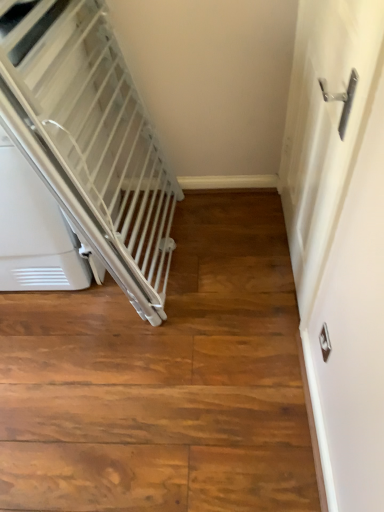
The height and width of the screenshot is (512, 384). What do you see at coordinates (90, 139) in the screenshot?
I see `white plastic escalator at left` at bounding box center [90, 139].

The image size is (384, 512). I want to click on white plastic escalator at left, so click(x=90, y=139).

What is the approximate height of white plastic escalator at left?

white plastic escalator at left is 35.92 inches tall.

The width and height of the screenshot is (384, 512). What do you see at coordinates (340, 239) in the screenshot? I see `white metallic door handle at right` at bounding box center [340, 239].

This screenshot has height=512, width=384. In order to click on white metallic door handle at right in this screenshot , I will do `click(340, 239)`.

Identify the location of white plastic escalator at left. (90, 139).

Between white plastic escalator at left and white metallic door handle at right, which one appears on the left side from the viewer's perspective?

Positioned to the left is white plastic escalator at left.

Does white plastic escalator at left come in front of white metallic door handle at right?

No, white plastic escalator at left is further to the viewer.

Considering the points (155, 212) and (327, 294), which point is behind, point (155, 212) or point (327, 294)?

The point (155, 212) is farther.

From the image's perspective, which one is positioned higher, white plastic escalator at left or white metallic door handle at right?

white plastic escalator at left is shown above in the image.

From a real-world perspective, relative to white metallic door handle at right, is white plastic escalator at left vertically above or below?

white plastic escalator at left is situated lower than white metallic door handle at right in the real world.

Considering the sizes of objects white plastic escalator at left and white metallic door handle at right in the image provided, who is wider, white plastic escalator at left or white metallic door handle at right?

white plastic escalator at left.

Does white plastic escalator at left have a greater height compared to white metallic door handle at right?

No, white plastic escalator at left is not taller than white metallic door handle at right.

Which of these two, white plastic escalator at left or white metallic door handle at right, is bigger?

white plastic escalator at left is bigger.

Is white metallic door handle at right completely or partially inside white plastic escalator at left?

Actually, white metallic door handle at right is outside white plastic escalator at left.

Is white plastic escalator at left next to white metallic door handle at right and touching it?

No, white plastic escalator at left is not touching white metallic door handle at right.

Is white plastic escalator at left facing away from white metallic door handle at right?

white plastic escalator at left is not turned away from white metallic door handle at right.

How many degrees apart are the facing directions of white plastic escalator at left and white metallic door handle at right?

The angular difference between white plastic escalator at left and white metallic door handle at right is 91.6 degrees.

In order to click on door located on the right of white plastic escalator at left in this screenshot , I will do `click(340, 239)`.

Which is more to the right, white metallic door handle at right or white plastic escalator at left?

Positioned to the right is white metallic door handle at right.

Between white metallic door handle at right and white plastic escalator at left, which one is positioned behind?

white plastic escalator at left is more distant.

Considering the points (359, 352) and (88, 221), which point is in front, point (359, 352) or point (88, 221)?

Point (359, 352)

From the image's perspective, which one is positioned lower, white metallic door handle at right or white plastic escalator at left?

white metallic door handle at right.

From a real-world perspective, is white metallic door handle at right beneath white plastic escalator at left?

No, from a real-world perspective, white metallic door handle at right is not below white plastic escalator at left.

Which of these two, white metallic door handle at right or white plastic escalator at left, is wider?

With larger width is white plastic escalator at left.

Does white metallic door handle at right have a greater height compared to white plastic escalator at left?

Yes, white metallic door handle at right is taller than white plastic escalator at left.

Considering the sizes of objects white metallic door handle at right and white plastic escalator at left in the image provided, who is smaller, white metallic door handle at right or white plastic escalator at left?

white metallic door handle at right is smaller.

Is white metallic door handle at right inside the boundaries of white plastic escalator at left, or outside?

white metallic door handle at right lies outside white plastic escalator at left.

Is white metallic door handle at right directly adjacent to white plastic escalator at left?

No, white metallic door handle at right is not touching white plastic escalator at left.

Is white metallic door handle at right looking in the opposite direction of white plastic escalator at left?

No.

How distant is white metallic door handle at right from white plastic escalator at left?

white metallic door handle at right is 26.45 inches from white plastic escalator at left.

Locate an element on the screen. This screenshot has width=384, height=512. door lying in front of the white plastic escalator at left is located at coordinates (340, 239).

Where is `escalator directly beneath the white metallic door handle at right (from a real-world perspective)`? The image size is (384, 512). escalator directly beneath the white metallic door handle at right (from a real-world perspective) is located at coordinates (90, 139).

I want to click on door above the white plastic escalator at left (from a real-world perspective), so click(x=340, y=239).